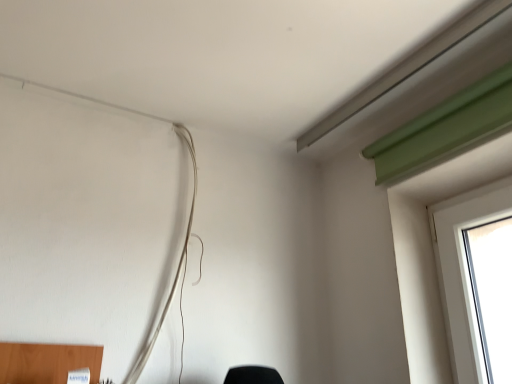
Find the location of a particular element. This screenshot has width=512, height=384. white matte wire at upper left is located at coordinates (x=178, y=262).

What do you see at coordinates (178, 262) in the screenshot?
I see `white matte wire at upper left` at bounding box center [178, 262].

The image size is (512, 384). What do you see at coordinates (253, 375) in the screenshot?
I see `black matte lampshade at lower center` at bounding box center [253, 375].

What is the approximate width of black matte lampshade at lower center?

8.18 inches.

In order to face black matte lampshade at lower center, should I rotate leftwards or rightwards?

It's best to rotate right around 0.478 degrees.

Image resolution: width=512 pixels, height=384 pixels. What are the coordinates of `black matte lampshade at lower center` in the screenshot? It's located at (253, 375).

This screenshot has height=384, width=512. What are the coordinates of `white matte wire at upper left` in the screenshot? It's located at (178, 262).

Considering the relative positions of white matte wire at upper left and black matte lampshade at lower center in the image provided, is white matte wire at upper left to the right of black matte lampshade at lower center from the viewer's perspective?

No.

Between white matte wire at upper left and black matte lampshade at lower center, which one is positioned behind?

white matte wire at upper left is further from the camera.

Considering the positions of point (185, 262) and point (279, 383), is point (185, 262) closer or farther from the camera than point (279, 383)?

Point (185, 262) is farther from the camera than point (279, 383).

From the image's perspective, is white matte wire at upper left beneath black matte lampshade at lower center?

No.

Consider the image. From a real-world perspective, is white matte wire at upper left located beneath black matte lampshade at lower center?

Actually, white matte wire at upper left is physically above black matte lampshade at lower center in the real world.

Is white matte wire at upper left wider or thinner than black matte lampshade at lower center?

Clearly, white matte wire at upper left has less width compared to black matte lampshade at lower center.

Considering the relative sizes of white matte wire at upper left and black matte lampshade at lower center in the image provided, is white matte wire at upper left taller than black matte lampshade at lower center?

Yes.

Which of these two, white matte wire at upper left or black matte lampshade at lower center, is bigger?

Bigger between the two is white matte wire at upper left.

Is white matte wire at upper left not inside black matte lampshade at lower center?

That's correct, white matte wire at upper left is outside of black matte lampshade at lower center.

Is white matte wire at upper left touching black matte lampshade at lower center?

white matte wire at upper left and black matte lampshade at lower center are not in contact.

Is white matte wire at upper left facing towards black matte lampshade at lower center?

No, white matte wire at upper left is not facing towards black matte lampshade at lower center.

This screenshot has height=384, width=512. Find the location of `wire located above the black matte lampshade at lower center (from the image's perspective)`. wire located above the black matte lampshade at lower center (from the image's perspective) is located at coordinates (178, 262).

Is black matte lampshade at lower center at the left side of white matte wire at upper left?

In fact, black matte lampshade at lower center is to the right of white matte wire at upper left.

Considering their positions, is black matte lampshade at lower center located in front of or behind white matte wire at upper left?

Visually, black matte lampshade at lower center is located in front of white matte wire at upper left.

Is point (260, 369) farther from camera compared to point (193, 150)?

That is False.

From the image's perspective, is black matte lampshade at lower center positioned above or below white matte wire at upper left?

Based on their image positions, black matte lampshade at lower center is located beneath white matte wire at upper left.

From a real-world perspective, relative to white matte wire at upper left, is black matte lampshade at lower center vertically above or below?

black matte lampshade at lower center is situated lower than white matte wire at upper left in the real world.

Considering the sizes of objects black matte lampshade at lower center and white matte wire at upper left in the image provided, who is wider, black matte lampshade at lower center or white matte wire at upper left?

With larger width is black matte lampshade at lower center.

Considering the sizes of objects black matte lampshade at lower center and white matte wire at upper left in the image provided, who is shorter, black matte lampshade at lower center or white matte wire at upper left?

black matte lampshade at lower center is shorter.

Considering the sizes of objects black matte lampshade at lower center and white matte wire at upper left in the image provided, who is smaller, black matte lampshade at lower center or white matte wire at upper left?

With smaller size is black matte lampshade at lower center.

Is black matte lampshade at lower center located outside white matte wire at upper left?

Yes.

Would you consider black matte lampshade at lower center to be distant from white matte wire at upper left?

No, black matte lampshade at lower center is not far away from white matte wire at upper left.

Is black matte lampshade at lower center oriented away from white matte wire at upper left?

No, black matte lampshade at lower center is not facing the opposite direction of white matte wire at upper left.

This screenshot has height=384, width=512. What are the coordinates of `wire above the black matte lampshade at lower center (from a real-world perspective)` in the screenshot? It's located at pos(178,262).

The image size is (512, 384). What are the coordinates of `wire behind the black matte lampshade at lower center` in the screenshot? It's located at (178, 262).

Image resolution: width=512 pixels, height=384 pixels. I want to click on furniture that is in front of the white matte wire at upper left, so click(x=253, y=375).